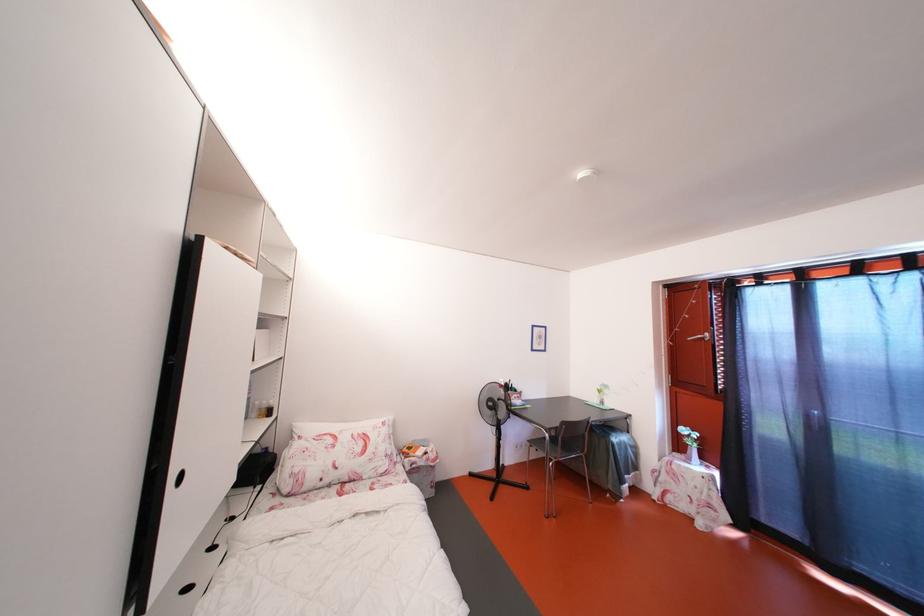
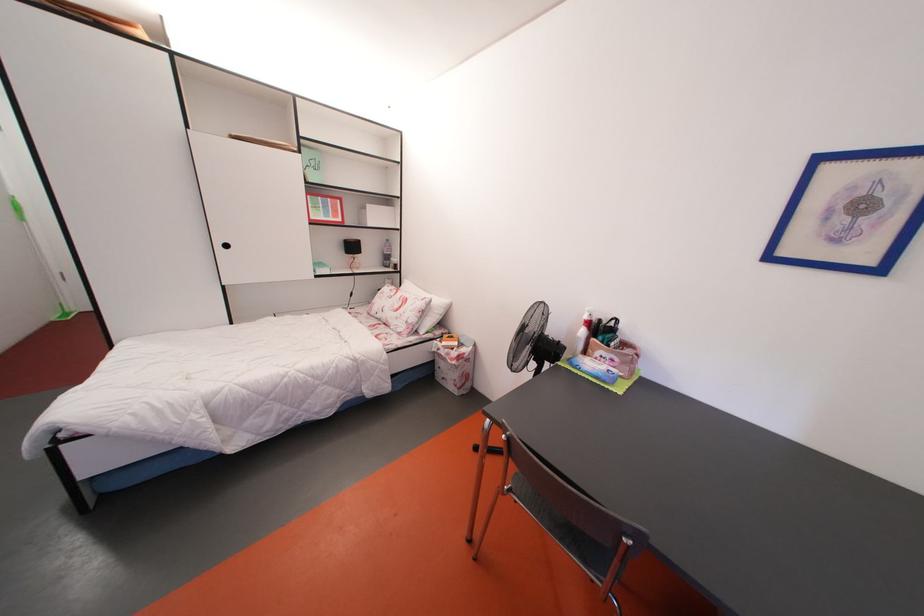
Where in the second image is the point corresponding to [396,458] from the first image?

(417, 326)